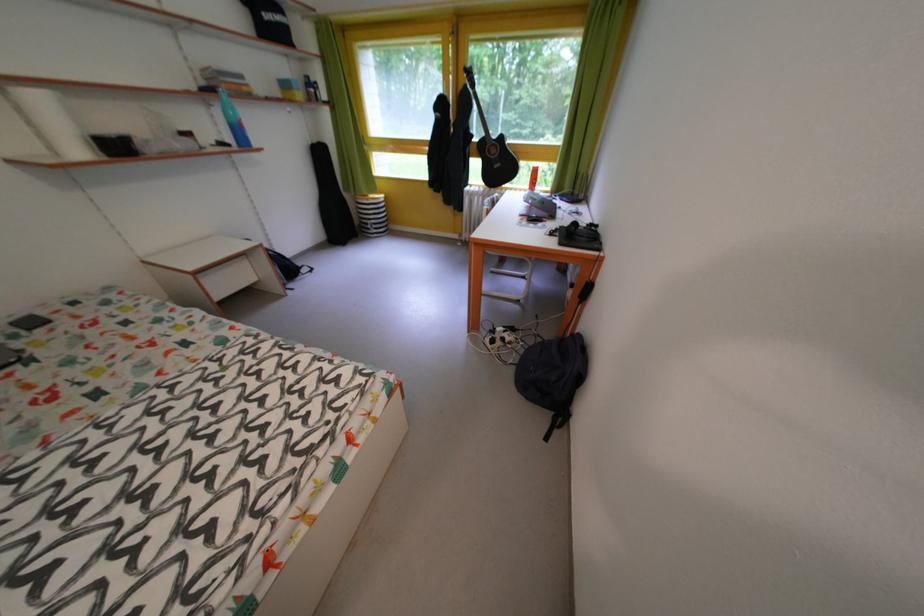
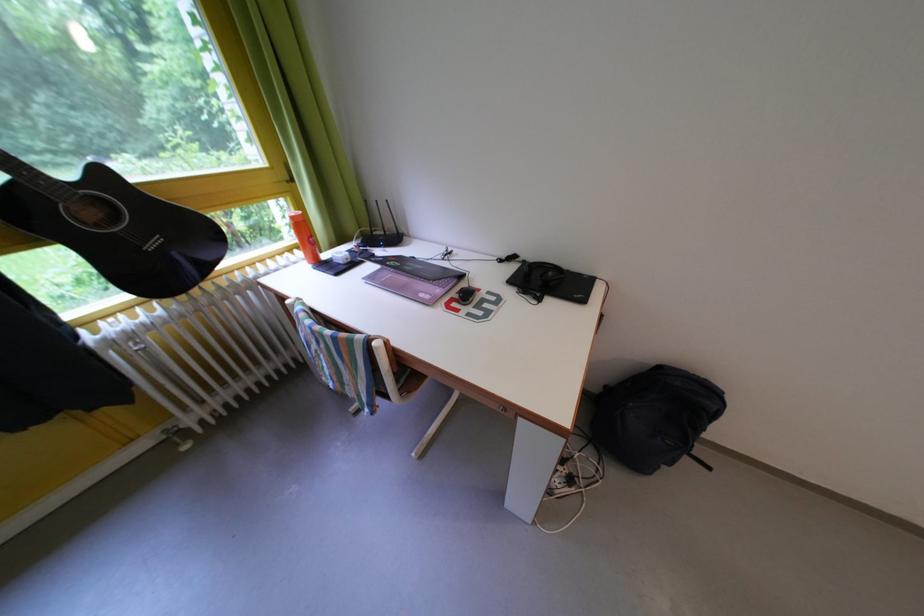
Where in the second image is the point corresponding to the point at 482,199 from the first image?

(140, 342)